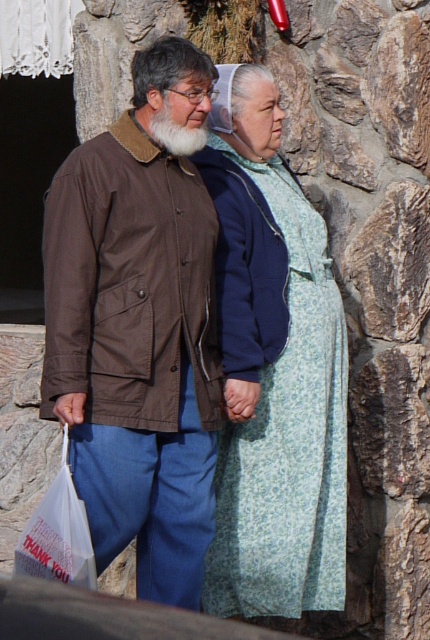
Which is more to the left, brown fabric jacket at left or smooth skin hand at center?

From the viewer's perspective, brown fabric jacket at left appears more on the left side.

Which is above, brown fabric jacket at left or smooth skin hand at center?

brown fabric jacket at left is higher up.

Between point (128, 188) and point (239, 380), which one is positioned in front?

Point (128, 188) is more forward.

Where is `brown fabric jacket at left`? The width and height of the screenshot is (430, 640). brown fabric jacket at left is located at coordinates (140, 324).

Can you confirm if white plastic bag at lower left is taller than white matte plastic bag at lower left?

Yes.

Who is more forward, (61,492) or (55,410)?

Point (61,492) is more forward.

You are a GUI agent. You are given a task and a screenshot of the screen. Output one action in this format:
    pyautogui.click(x=<x>, y=<y>)
    Task: Click on the white plastic bag at lower left
    The height and width of the screenshot is (640, 430).
    Given the screenshot: What is the action you would take?
    pyautogui.click(x=58, y=534)

Looking at this image, does light green floral dress at center lie behind white matte plastic bag at lower left?

Yes, it is.

Who is more forward, [223,129] or [82,401]?

Positioned in front is point [82,401].

Is point (261, 579) behind point (55, 406)?

Yes, point (261, 579) is behind point (55, 406).

You are a GUI agent. You are given a task and a screenshot of the screen. Output one action in this format:
    pyautogui.click(x=<x>, y=<y>)
    Task: Click on the light green floral dress at center
    
    Given the screenshot: What is the action you would take?
    pyautogui.click(x=273, y=369)